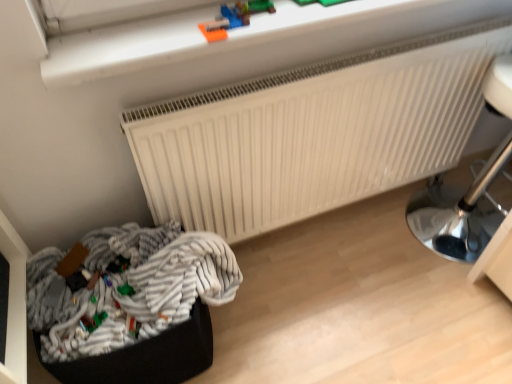
Find the location of a particular element. The height and width of the screenshot is (384, 512). vacant space in front of green plastic toy at lower left, the 3th toy positioned from the right is located at coordinates pos(88,352).